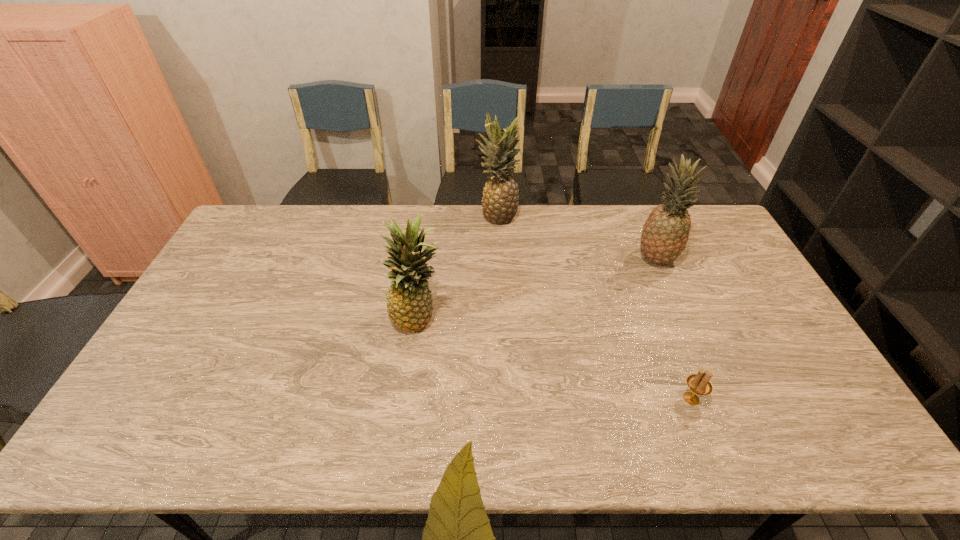
This screenshot has height=540, width=960. In order to click on the third closest object relative to the shortest object in this screenshot , I will do `click(500, 200)`.

Select which object appears as the closest to the third nearest object. Please provide its 2D coordinates. Your answer should be formatted as a tuple, i.e. [(x, y)], where the tuple contains the x and y coordinates of a point satisfying the conditions above.

[(500, 200)]

Where is `pineapple that is the second closest to the nearest pineapple`? This screenshot has height=540, width=960. pineapple that is the second closest to the nearest pineapple is located at coordinates (665, 233).

Locate an element on the screen. pineapple that is the closest to the third nearest object is located at coordinates (500, 200).

What are the coordinates of `vacant space that satisfies the following two spatial constraints: 1. on the front side of the second farthest pineapple; 2. on the right side of the second pineapple from right to left` in the screenshot? It's located at (499, 259).

Locate an element on the screen. vacant area that satisfies the following two spatial constraints: 1. on the front side of the candle holder; 2. on the left side of the second object from left to right is located at coordinates (506, 399).

In order to click on vacant region that satisfies the following two spatial constraints: 1. on the front side of the second pineapple from right to left; 2. on the left side of the rightmost pineapple in this screenshot , I will do `click(499, 259)`.